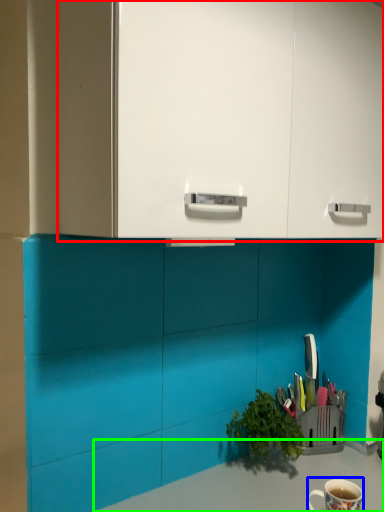
Question: Which is farther away from dresser (highlighted by a red box)? coffee cup (highlighted by a blue box) or counter top (highlighted by a green box)?

Choices:
 (A) coffee cup
 (B) counter top

Answer: (A)